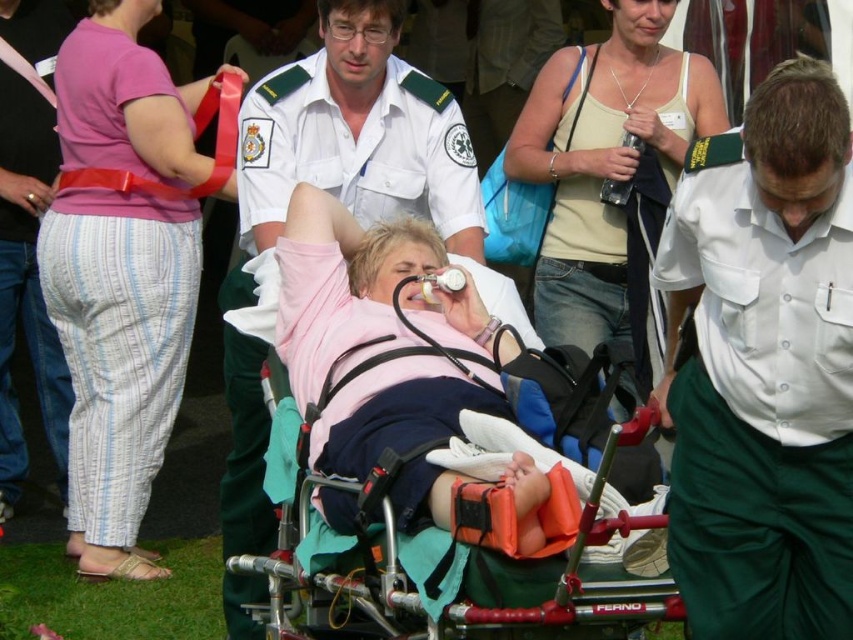
Question: Which of the following is the farthest from the observer?

Choices:
 (A) white uniform at center
 (B) pink cotton pants at left
 (C) metallic stretcher at center

Answer: (B)

Question: Among these objects, which one is farthest from the camera?

Choices:
 (A) white uniform at center
 (B) white smooth uniform at center
 (C) matte white tank top at upper center

Answer: (C)

Question: Is white uniform at center further to camera compared to metallic stretcher at center?

Choices:
 (A) yes
 (B) no

Answer: (A)

Question: Is pink cotton pants at left thinner than white uniform at center?

Choices:
 (A) yes
 (B) no

Answer: (A)

Question: Which object is farther from the camera taking this photo?

Choices:
 (A) white smooth uniform at center
 (B) pink cotton pants at left

Answer: (B)

Question: Is white smooth uniform at center below white uniform at center?

Choices:
 (A) no
 (B) yes

Answer: (A)